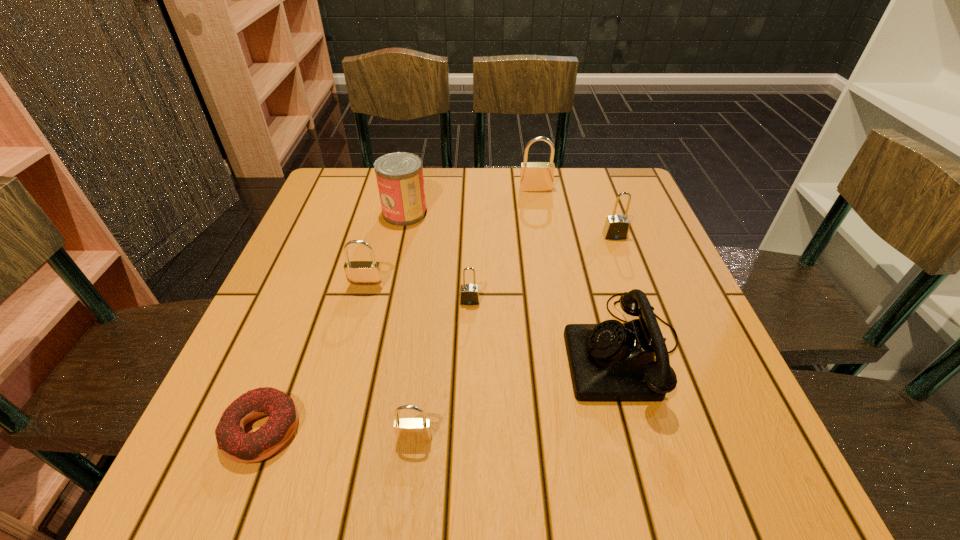
Locate an element on the screen. This screenshot has width=960, height=540. the fourth padlock from left to right is located at coordinates (534, 176).

At what (x,y) coordinates should I click in order to perform the action: click on the biggest brass padlock. Please return your answer as a coordinate pair (x, y). Image resolution: width=960 pixels, height=540 pixels. Looking at the image, I should click on (534, 176).

At what (x,y) coordinates should I click in order to perform the action: click on can. Please return your answer as a coordinate pair (x, y). The width and height of the screenshot is (960, 540). Looking at the image, I should click on (399, 175).

You are a GUI agent. You are given a task and a screenshot of the screen. Output one action in this format:
    pyautogui.click(x=<x>, y=<y>)
    Task: Click on the second farthest padlock
    This screenshot has width=960, height=540.
    Given the screenshot: What is the action you would take?
    pyautogui.click(x=616, y=227)

Locate an element on the screen. the right gray padlock is located at coordinates (616, 227).

At what (x,y) coordinates should I click in order to perform the action: click on the second smallest brass padlock. Please return your answer as a coordinate pair (x, y). The image size is (960, 540). Looking at the image, I should click on (360, 274).

Where is `the third nearest padlock`? This screenshot has width=960, height=540. the third nearest padlock is located at coordinates (360, 274).

Identify the location of telephone. (611, 361).

You are a GUI agent. You are given a task and a screenshot of the screen. Output one action in this format:
    pyautogui.click(x=<x>, y=<y>)
    Task: Click on the fifth object from left to right
    This screenshot has width=960, height=540.
    Given the screenshot: What is the action you would take?
    pyautogui.click(x=469, y=293)

This screenshot has width=960, height=540. In order to click on the nearer gray padlock in this screenshot , I will do `click(469, 293)`.